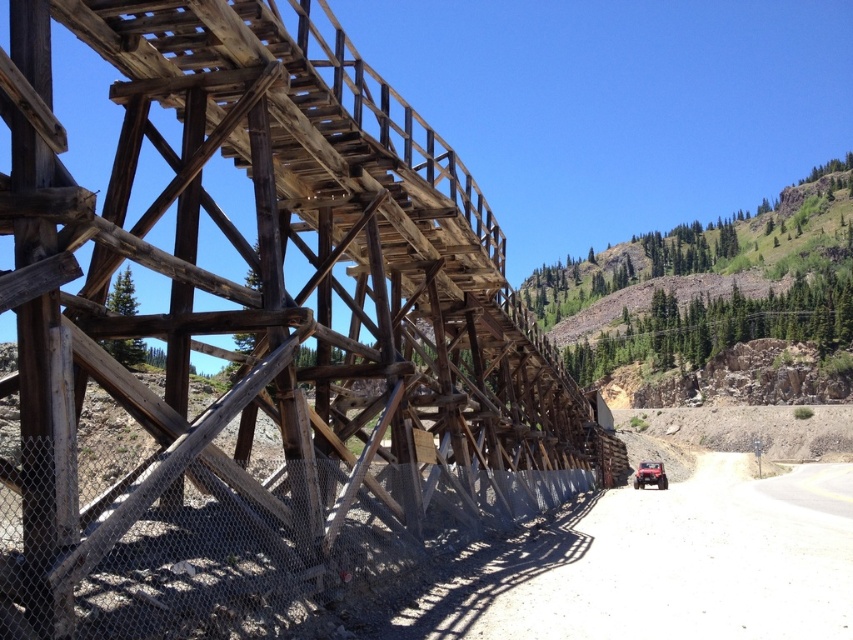
Question: Is weathered wood train bridge at center wider than rubberized matte red car at lower right?

Choices:
 (A) yes
 (B) no

Answer: (A)

Question: Which point is farther to the camera?

Choices:
 (A) rubberized matte red car at lower right
 (B) weathered wood train bridge at center

Answer: (A)

Question: Is weathered wood train bridge at center to the left of rubberized matte red car at lower right from the viewer's perspective?

Choices:
 (A) no
 (B) yes

Answer: (B)

Question: Which point is closer to the camera taking this photo?

Choices:
 (A) (639, 480)
 (B) (96, 486)

Answer: (B)

Question: Is weathered wood train bridge at center positioned in front of rubberized matte red car at lower right?

Choices:
 (A) yes
 (B) no

Answer: (A)

Question: Which object appears farthest from the camera in this image?

Choices:
 (A) rubberized matte red car at lower right
 (B) weathered wood train bridge at center

Answer: (A)